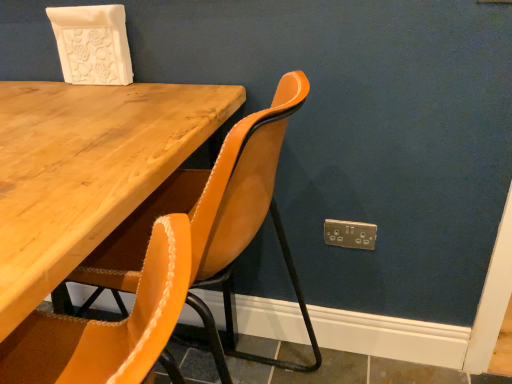
The image size is (512, 384). Describe the element at coordinates (350, 234) in the screenshot. I see `gold metallic electric outlet at lower right` at that location.

What is the approximate width of gold metallic electric outlet at lower right?

The width of gold metallic electric outlet at lower right is 0.50 inches.

Find the location of `gold metallic electric outlet at lower right`. gold metallic electric outlet at lower right is located at coordinates (350, 234).

Describe the element at coordinates (213, 214) in the screenshot. This screenshot has width=512, height=384. I see `suede-like mustard chair at center` at that location.

Where is `suede-like mustard chair at center`? This screenshot has width=512, height=384. suede-like mustard chair at center is located at coordinates (213, 214).

This screenshot has height=384, width=512. Identify the location of gold metallic electric outlet at lower right. (350, 234).

Can you confirm if gold metallic electric outlet at lower right is positioned to the left of suede-like mustard chair at center?

No, gold metallic electric outlet at lower right is not to the left of suede-like mustard chair at center.

Which object is closer to the camera, gold metallic electric outlet at lower right or suede-like mustard chair at center?

suede-like mustard chair at center.

Between point (346, 235) and point (216, 168), which one is positioned behind?

The point (346, 235) is behind.

From the image's perspective, which is above, gold metallic electric outlet at lower right or suede-like mustard chair at center?

gold metallic electric outlet at lower right, from the image's perspective.

From a real-world perspective, is gold metallic electric outlet at lower right below suede-like mustard chair at center?

Indeed, from a real-world perspective, gold metallic electric outlet at lower right is positioned beneath suede-like mustard chair at center.

Which of these two, gold metallic electric outlet at lower right or suede-like mustard chair at center, is thinner?

With smaller width is gold metallic electric outlet at lower right.

Between gold metallic electric outlet at lower right and suede-like mustard chair at center, which one has less height?

gold metallic electric outlet at lower right is shorter.

Between gold metallic electric outlet at lower right and suede-like mustard chair at center, which one has larger size?

With larger size is suede-like mustard chair at center.

Choose the correct answer: Is gold metallic electric outlet at lower right inside suede-like mustard chair at center or outside it?

The correct answer is: outside.

Are gold metallic electric outlet at lower right and suede-like mustard chair at center making contact?

No, gold metallic electric outlet at lower right is not making contact with suede-like mustard chair at center.

Could you tell me if gold metallic electric outlet at lower right is turned towards suede-like mustard chair at center?

No, gold metallic electric outlet at lower right is not turned towards suede-like mustard chair at center.

How different are the orientations of gold metallic electric outlet at lower right and suede-like mustard chair at center in degrees?

The angle between the facing direction of gold metallic electric outlet at lower right and the facing direction of suede-like mustard chair at center is 92.4 degrees.

Measure the distance from gold metallic electric outlet at lower right to suede-like mustard chair at center.

gold metallic electric outlet at lower right and suede-like mustard chair at center are 21.29 inches apart from each other.

Identify the location of chair in front of the gold metallic electric outlet at lower right. (213, 214).

Between suede-like mustard chair at center and gold metallic electric outlet at lower right, which one appears on the right side from the viewer's perspective?

Positioned to the right is gold metallic electric outlet at lower right.

Is suede-like mustard chair at center in front of gold metallic electric outlet at lower right?

Yes.

Which point is more distant from viewer, (270, 171) or (370, 247)?

The point (370, 247) is farther.

Looking at this image, from the image's perspective, is suede-like mustard chair at center positioned above or below gold metallic electric outlet at lower right?

suede-like mustard chair at center is below gold metallic electric outlet at lower right.

From a real-world perspective, relative to gold metallic electric outlet at lower right, is suede-like mustard chair at center vertically above or below?

Clearly, from a real-world perspective, suede-like mustard chair at center is above gold metallic electric outlet at lower right.

Which object is thinner, suede-like mustard chair at center or gold metallic electric outlet at lower right?

With smaller width is gold metallic electric outlet at lower right.

Considering the relative sizes of suede-like mustard chair at center and gold metallic electric outlet at lower right in the image provided, is suede-like mustard chair at center shorter than gold metallic electric outlet at lower right?

Incorrect, the height of suede-like mustard chair at center does not fall short of that of gold metallic electric outlet at lower right.

In the scene shown: Which of these two, suede-like mustard chair at center or gold metallic electric outlet at lower right, is smaller?

gold metallic electric outlet at lower right.

In the scene shown: Would you say suede-like mustard chair at center is outside gold metallic electric outlet at lower right?

Yes.

Would you consider suede-like mustard chair at center to be distant from gold metallic electric outlet at lower right?

Actually, suede-like mustard chair at center and gold metallic electric outlet at lower right are a little close together.

Is gold metallic electric outlet at lower right at the back of suede-like mustard chair at center?

suede-like mustard chair at center is not turned away from gold metallic electric outlet at lower right.

How far apart are suede-like mustard chair at center and gold metallic electric outlet at lower right?

The distance of suede-like mustard chair at center from gold metallic electric outlet at lower right is 21.29 inches.

I want to click on electric outlet below the suede-like mustard chair at center (from a real-world perspective), so click(x=350, y=234).

Find the location of a particular element. This screenshot has height=384, width=512. chair on the left of gold metallic electric outlet at lower right is located at coordinates (213, 214).

In the image, there is a suede-like mustard chair at center. What are the coordinates of `electric outlet above it (from the image's perspective)` in the screenshot? It's located at (350, 234).